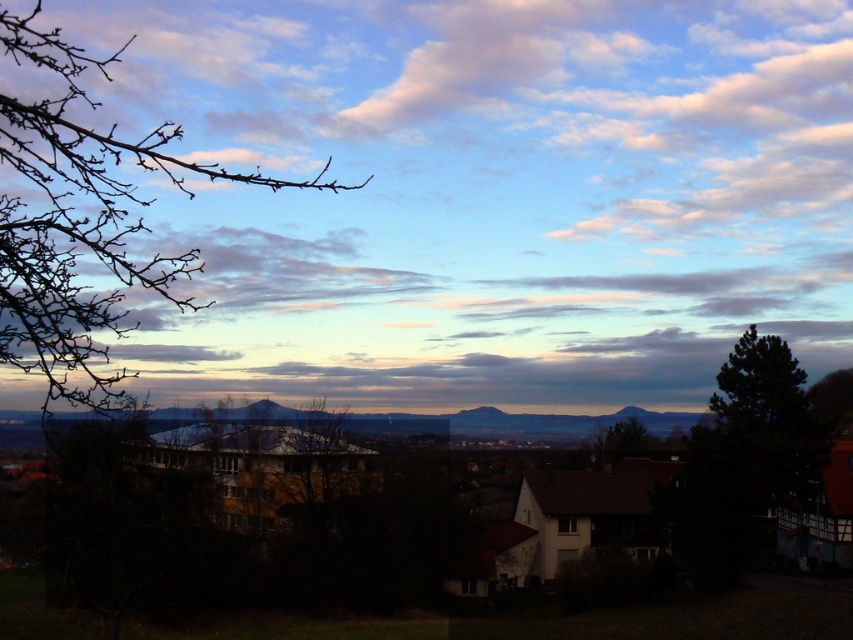
Question: Considering the relative positions of brown bare branches at left and dark green coniferous tree at right in the image provided, where is brown bare branches at left located with respect to dark green coniferous tree at right?

Choices:
 (A) above
 (B) below

Answer: (A)

Question: Is cloudy sky at upper center below dark green coniferous tree at right?

Choices:
 (A) no
 (B) yes

Answer: (A)

Question: Can you confirm if cloudy sky at upper center is bigger than brown bare branches at left?

Choices:
 (A) yes
 (B) no

Answer: (A)

Question: Which is farther from the cloudy sky at upper center?

Choices:
 (A) dark green coniferous tree at right
 (B) green leafy tree at center

Answer: (A)

Question: Which object is positioned closest to the dark green coniferous tree at right?

Choices:
 (A) green leafy tree at center
 (B) cloudy sky at upper center
 (C) brown bare branches at left

Answer: (C)

Question: Which point is farther to the camera?

Choices:
 (A) (796, 465)
 (B) (68, 141)

Answer: (A)